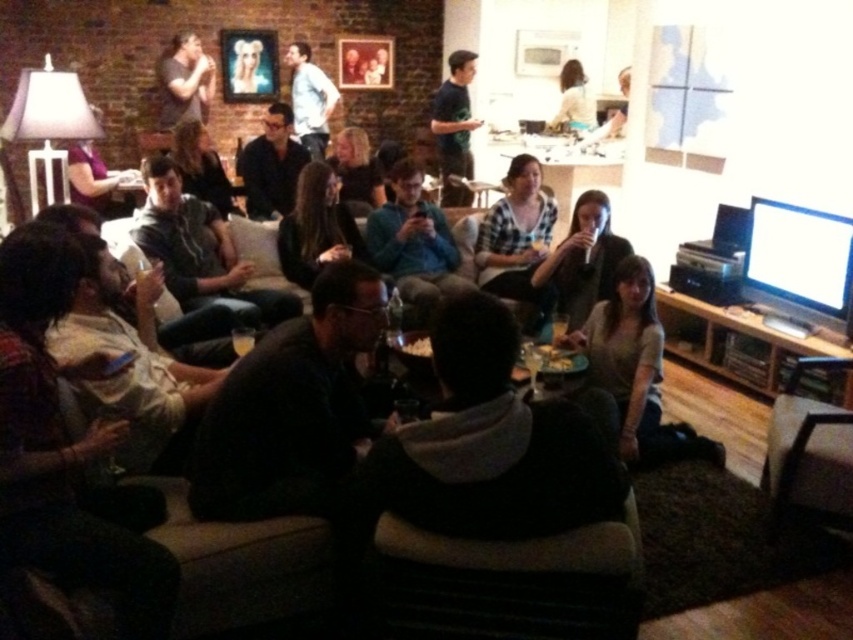
The image size is (853, 640). I want to click on matte black microphone at center, so click(x=582, y=260).

Between matte black microphone at center and white shirt at upper center, which one has less height?

Standing shorter between the two is matte black microphone at center.

Is point (590, 189) behind point (299, 86)?

No, (590, 189) is in front of (299, 86).

Find the location of `matte black microphone at center`. matte black microphone at center is located at coordinates (582, 260).

Does white shirt at upper center have a greater width compared to light brown hair at upper center?

Yes, white shirt at upper center is wider than light brown hair at upper center.

In the scene shown: Is white shirt at upper center bigger than light brown hair at upper center?

Correct, white shirt at upper center is larger in size than light brown hair at upper center.

Between point (318, 104) and point (585, 96), which one is positioned in front?

Point (318, 104)

Locate an element on the screen. white shirt at upper center is located at coordinates (310, 99).

Which of these two, dark brown hair at center or white shirt at upper center, stands shorter?

dark brown hair at center

Is point (318, 237) more distant than point (312, 116)?

No.

Where is `dark brown hair at center`? This screenshot has height=640, width=853. dark brown hair at center is located at coordinates (316, 227).